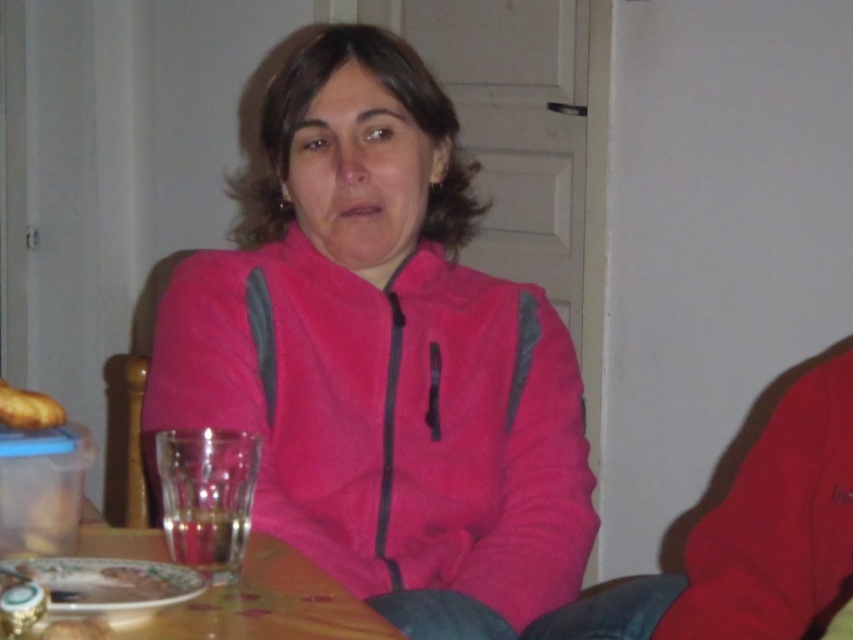
Question: Is pink fleece jacket at center wider than golden brown bread at left?

Choices:
 (A) yes
 (B) no

Answer: (A)

Question: Is pink fleece jacket at center wider than golden brown bread at left?

Choices:
 (A) yes
 (B) no

Answer: (A)

Question: Which object is farther from the camera taking this photo?

Choices:
 (A) golden brown bread at left
 (B) wooden table at lower center

Answer: (A)

Question: Which object is the closest to the golden brown bread at left?

Choices:
 (A) wooden table at lower center
 (B) pink fleece jacket at center

Answer: (A)

Question: Which point is farther to the camera?

Choices:
 (A) wooden table at lower center
 (B) pink fleece jacket at center
 (C) golden brown bread at left

Answer: (B)

Question: Can you confirm if pink fleece jacket at center is wider than golden brown bread at left?

Choices:
 (A) yes
 (B) no

Answer: (A)